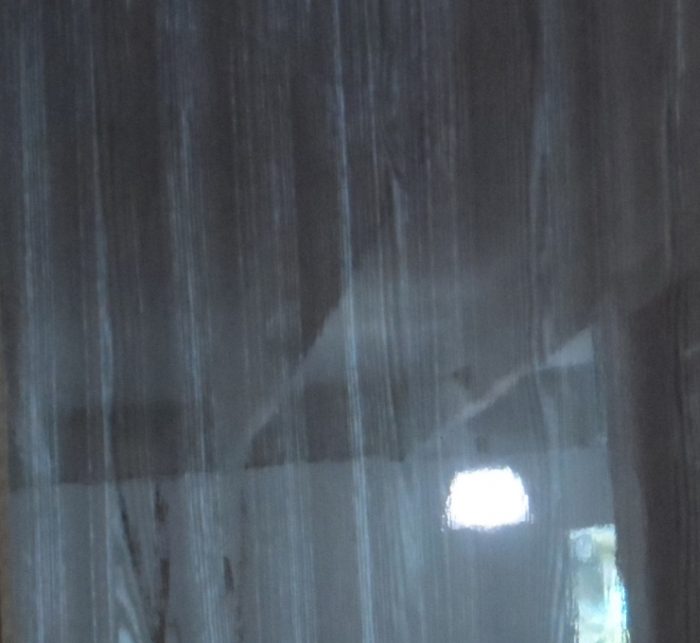
The image size is (700, 643). Identify the location of load bearing ceiling beams. (19, 409), (253, 430), (466, 410).